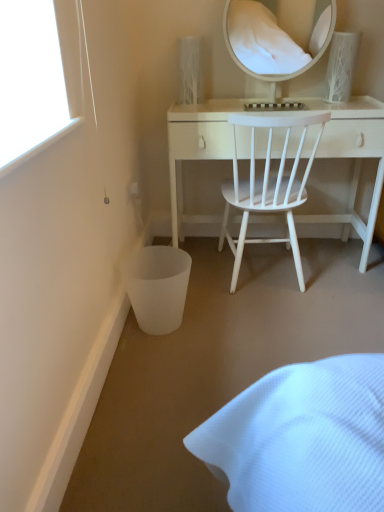
The height and width of the screenshot is (512, 384). I want to click on vacant space to the right of white glossy mirror at upper center, so (345, 102).